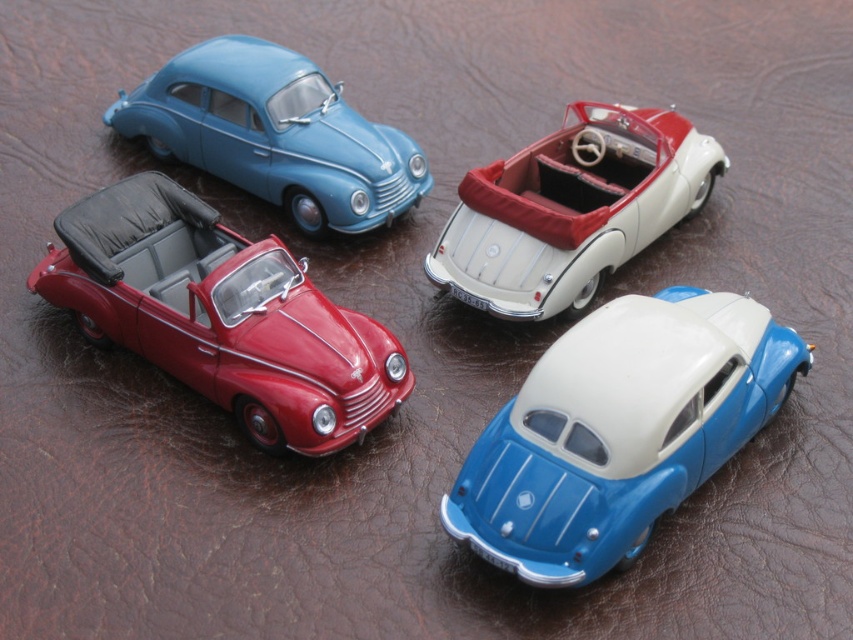
You are a collector who wants to display both the shiny red convertible at upper left and the white matte convertible at upper center side by side on a shelf. Which car requires more horizontal space for proper display?

The shiny red convertible at upper left requires more horizontal space for proper display because its width surpasses that of the white matte convertible at upper center.

You are a collector arranging miniature cars on a display. You have a blue glossy toy car at lower right. Where exactly should you place it to match the existing arrangement shown in the image?

The blue glossy toy car at lower right should be placed at point (619, 429) to match the existing arrangement shown in the image.